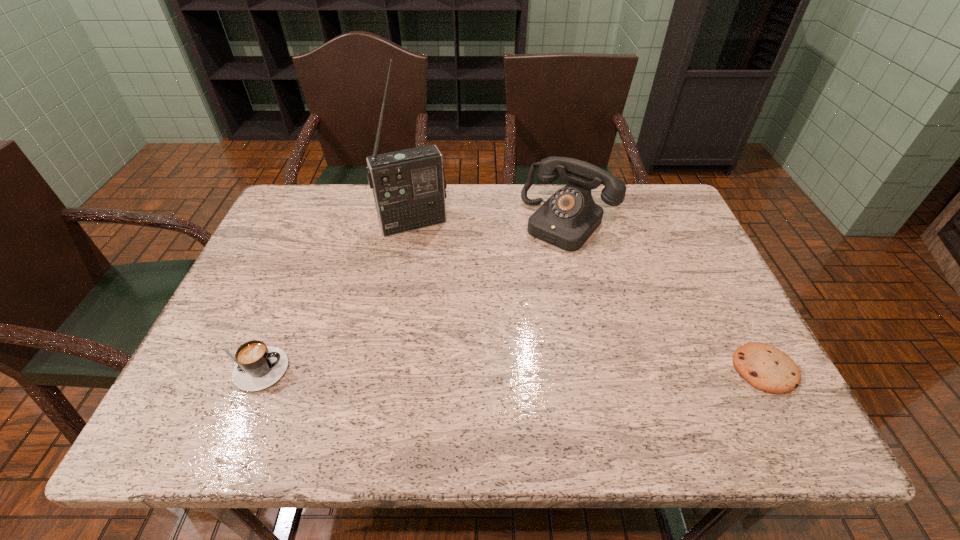
Identify the location of the leftmost object. The image size is (960, 540). (258, 366).

Identify the location of cappuccino. (258, 366).

Find the location of `the shortest object`. the shortest object is located at coordinates (766, 368).

The width and height of the screenshot is (960, 540). In order to click on cookie in this screenshot , I will do `click(766, 368)`.

Where is `telephone`? telephone is located at coordinates (568, 218).

You are a GUI agent. You are given a task and a screenshot of the screen. Output one action in this format:
    pyautogui.click(x=<x>, y=<y>)
    Task: Click on the third shortest object
    
    Given the screenshot: What is the action you would take?
    pyautogui.click(x=568, y=218)

This screenshot has height=540, width=960. Find the location of `the second object from left to right`. the second object from left to right is located at coordinates (409, 186).

You are a GUI agent. You are given a task and a screenshot of the screen. Output one action in this format:
    pyautogui.click(x=<x>, y=<y>)
    Task: Click on the radio receiver
    
    Given the screenshot: What is the action you would take?
    pyautogui.click(x=409, y=186)

Locate an element on the screen. free region located with the handle on the side of the cappuccino is located at coordinates (393, 370).

Where is `vacant space situated on the left of the cookie`? The height and width of the screenshot is (540, 960). vacant space situated on the left of the cookie is located at coordinates (682, 369).